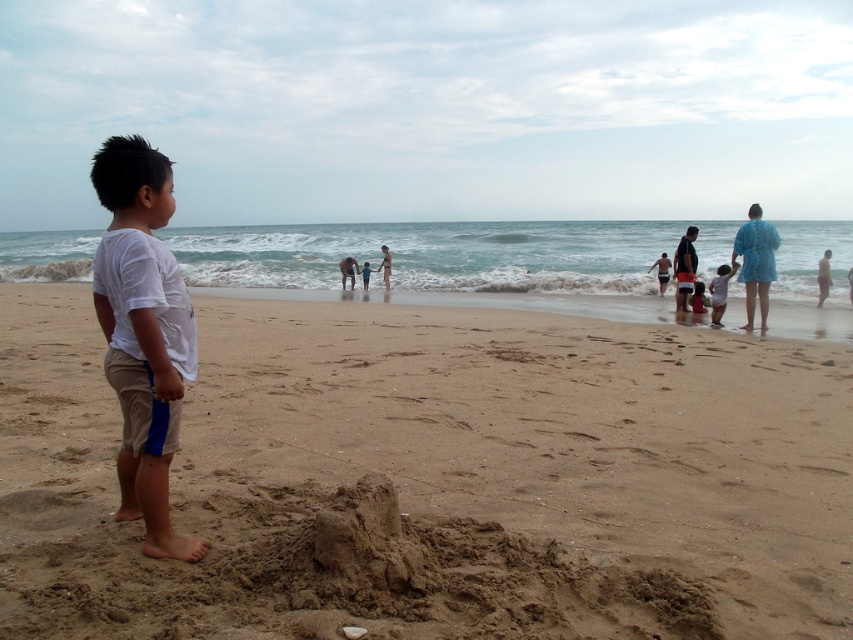
Does white cotton shirt at left lie in front of matte pink shorts at lower right?

Yes, white cotton shirt at left is in front of matte pink shorts at lower right.

Does white cotton shirt at left have a greater height compared to matte pink shorts at lower right?

Yes.

The image size is (853, 640). What do you see at coordinates (143, 332) in the screenshot?
I see `white cotton shirt at left` at bounding box center [143, 332].

At what (x,y) coordinates should I click in order to perform the action: click on white cotton shirt at left. Please return your answer as a coordinate pair (x, y). The height and width of the screenshot is (640, 853). Looking at the image, I should click on (143, 332).

Does smooth sand at center appear on the right side of matte pink shorts at lower right?

In fact, smooth sand at center is to the left of matte pink shorts at lower right.

Is smooth sand at center positioned in front of matte pink shorts at lower right?

No, smooth sand at center is behind matte pink shorts at lower right.

Locate an element on the screen. The width and height of the screenshot is (853, 640). smooth sand at center is located at coordinates (347, 269).

You are a GUI agent. You are given a task and a screenshot of the screen. Output one action in this format:
    pyautogui.click(x=<x>, y=<y>)
    Task: Click on the smooth sand at center
    This screenshot has width=853, height=640.
    Given the screenshot: What is the action you would take?
    pyautogui.click(x=347, y=269)

Can you confirm if dark blue shorts at center right is thinner than matte pink shorts at lower right?

No.

Is dark blue shorts at center right taller than matte pink shorts at lower right?

Yes.

Is point (677, 308) farther from viewer compared to point (699, 310)?

Yes.

Locate an element on the screen. This screenshot has height=640, width=853. dark blue shorts at center right is located at coordinates (683, 268).